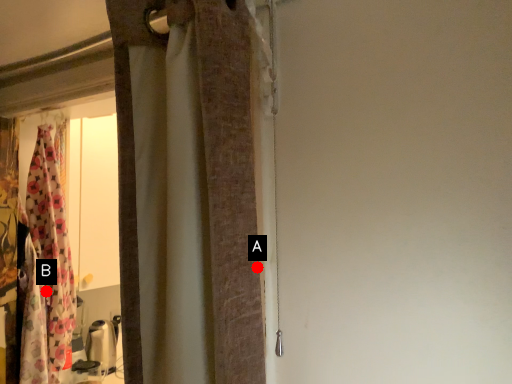
Question: Two points are circled on the image, labeled by A and B beside each circle. Which point is further to the camera?

Choices:
 (A) A is further
 (B) B is further

Answer: (B)